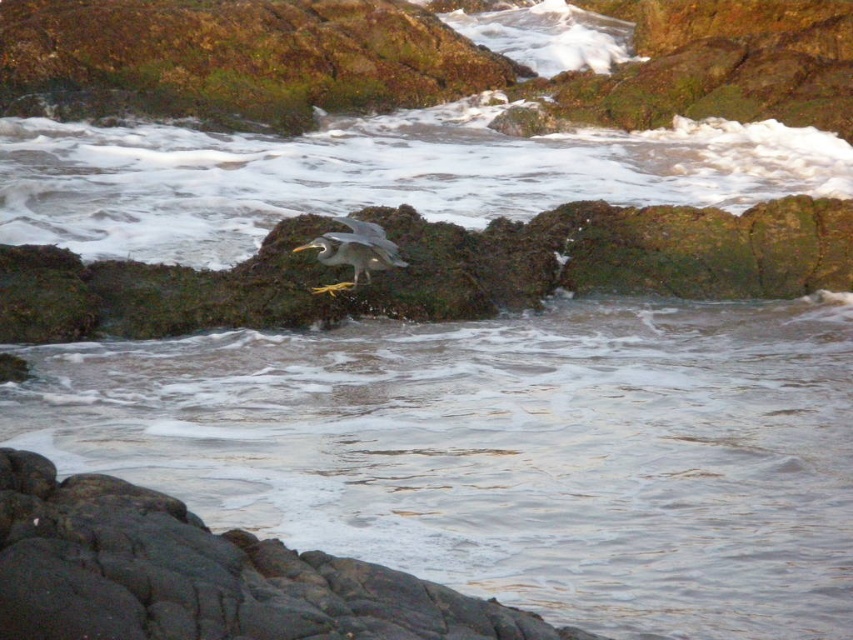
In the scene shown: You are standing on the shore and see the smooth gray rock at lower center and the gray matte bird at center. Which object is closer to the water surface?

The smooth gray rock at lower center is closer to the water surface because it is located below the gray matte bird at center.

You are a photographer trying to capture the bird in flight. You notice the gray matte bird at center and the smooth gray rock at lower center in your viewfinder. Which object is positioned higher in the frame?

The gray matte bird at center is positioned higher in the frame than the smooth gray rock at lower center because the smooth gray rock at lower center is taller than the gray matte bird at center.